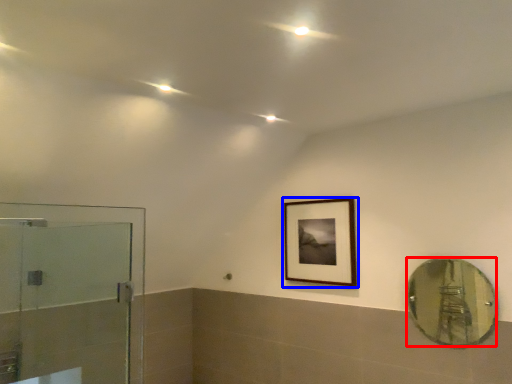
Question: Which object is further to the camera taking this photo, mirror (highlighted by a red box) or picture frame (highlighted by a blue box)?

Choices:
 (A) mirror
 (B) picture frame

Answer: (B)